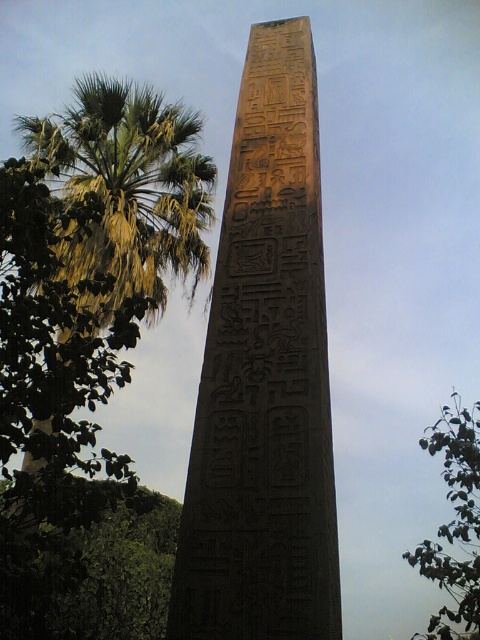
Measure the distance from brown carved stone obelisk at center to green leafy palm tree at left.

brown carved stone obelisk at center is 17.91 meters from green leafy palm tree at left.

Locate an element on the screen. Image resolution: width=480 pixels, height=640 pixels. brown carved stone obelisk at center is located at coordinates (264, 378).

Between point (110, 109) and point (444, 433), which one is positioned in front?

Positioned in front is point (444, 433).

Is green leafy palm tree at left above green leafy tree at upper right?

Correct, green leafy palm tree at left is located above green leafy tree at upper right.

In the scene shown: Who is more distant from viewer, (84, 112) or (448, 467)?

Point (84, 112)

In order to click on green leafy palm tree at left in this screenshot , I will do `click(131, 182)`.

Can you confirm if brown carved stone obelisk at center is positioned above green leafy tree at upper right?

Correct, brown carved stone obelisk at center is located above green leafy tree at upper right.

What do you see at coordinates (264, 378) in the screenshot? I see `brown carved stone obelisk at center` at bounding box center [264, 378].

Where is `brown carved stone obelisk at center`? Image resolution: width=480 pixels, height=640 pixels. brown carved stone obelisk at center is located at coordinates (264, 378).